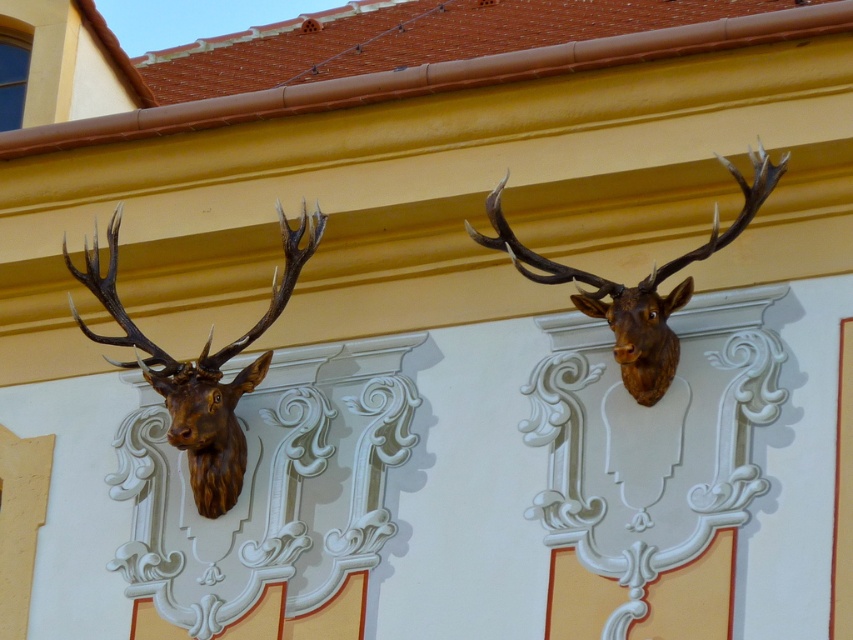
Between brown wooden deer head at left and brown polished wood deer head at upper center, which one is positioned lower?

brown polished wood deer head at upper center

Does brown wooden deer head at left have a smaller size compared to brown polished wood deer head at upper center?

Correct, brown wooden deer head at left occupies less space than brown polished wood deer head at upper center.

Is point (233, 381) more distant than point (753, 211)?

Yes, it is behind point (753, 211).

Identify the location of brown wooden deer head at left. Image resolution: width=853 pixels, height=640 pixels. (200, 369).